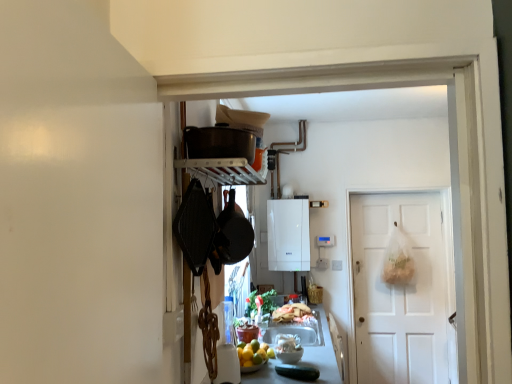
Question: Should I look upward or downward to see white glossy boiler at center, the first appliance positioned from the bottom?

Choices:
 (A) down
 (B) up

Answer: (A)

Question: Is black matte wok at center further to camera compared to matte black pot at upper center, which appears as the first appliance when viewed from the top?

Choices:
 (A) yes
 (B) no

Answer: (A)

Question: Is the position of black matte wok at center less distant than that of matte black pot at upper center, which appears as the first appliance when viewed from the top?

Choices:
 (A) yes
 (B) no

Answer: (B)

Question: Is black matte wok at center bigger than matte black pot at upper center, acting as the second appliance starting from the back?

Choices:
 (A) yes
 (B) no

Answer: (A)

Question: Considering the relative sizes of black matte wok at center and matte black pot at upper center, which appears as the first appliance when viewed from the top, in the image provided, is black matte wok at center shorter than matte black pot at upper center, which appears as the first appliance when viewed from the top,?

Choices:
 (A) no
 (B) yes

Answer: (A)

Question: Does black matte wok at center have a greater width compared to matte black pot at upper center, the second appliance when ordered from right to left?

Choices:
 (A) no
 (B) yes

Answer: (A)

Question: From the image's perspective, is black matte wok at center above matte black pot at upper center, arranged as the first appliance when viewed from the left?

Choices:
 (A) yes
 (B) no

Answer: (B)

Question: Does shiny plastic bag of bread at center, which appears as the 1th food when viewed from the back, have a smaller size compared to white matte door at center?

Choices:
 (A) no
 (B) yes

Answer: (B)

Question: Can you confirm if shiny plastic bag of bread at center, which is counted as the 2th food, starting from the front, is taller than white matte door at center?

Choices:
 (A) yes
 (B) no

Answer: (B)

Question: Can you confirm if shiny plastic bag of bread at center, which is counted as the 2th food, starting from the front, is shorter than white matte door at center?

Choices:
 (A) yes
 (B) no

Answer: (A)

Question: Can you see shiny plastic bag of bread at center, which is counted as the 2th food, starting from the front, touching white matte door at center?

Choices:
 (A) yes
 (B) no

Answer: (B)

Question: Considering the relative positions of shiny plastic bag of bread at center, which appears as the 1th food when viewed from the back, and white matte door at center in the image provided, is shiny plastic bag of bread at center, which appears as the 1th food when viewed from the back, in front of white matte door at center?

Choices:
 (A) yes
 (B) no

Answer: (A)

Question: Is white matte door at center completely or partially inside shiny plastic bag of bread at center, which appears as the 1th food when viewed from the back?

Choices:
 (A) yes
 (B) no

Answer: (B)

Question: Is the depth of white glossy bowl at center, which is counted as the 2th food, starting from the back, greater than that of smooth gray countertop at center?

Choices:
 (A) no
 (B) yes

Answer: (B)